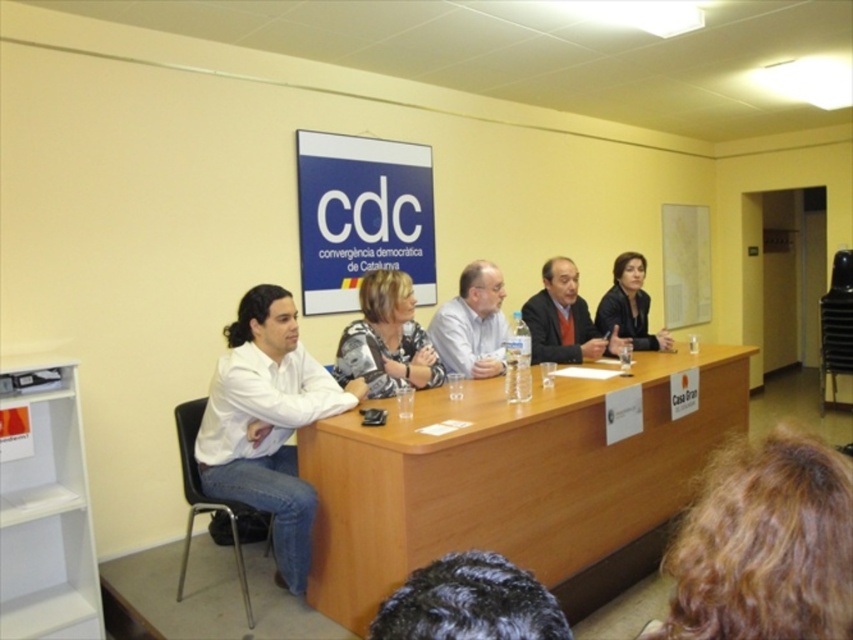
You are a photographer standing in front of the CDC sign at the back of the room. You want to take a photo of both the point at coordinates point (827, 572) and point (473, 596). Which point is closer to your camera?

Point (473, 596) is closer to the camera than point (827, 572).

You are attending a press conference and need to place a name tag on the table. The name tag is 10 cm wide. Can you fit it on the light brown wood table at center without overlapping the black leather jacket at center?

The light brown wood table at center is located below the black leather jacket at center, so there is enough space to place the name tag on the table without overlapping the jacket.